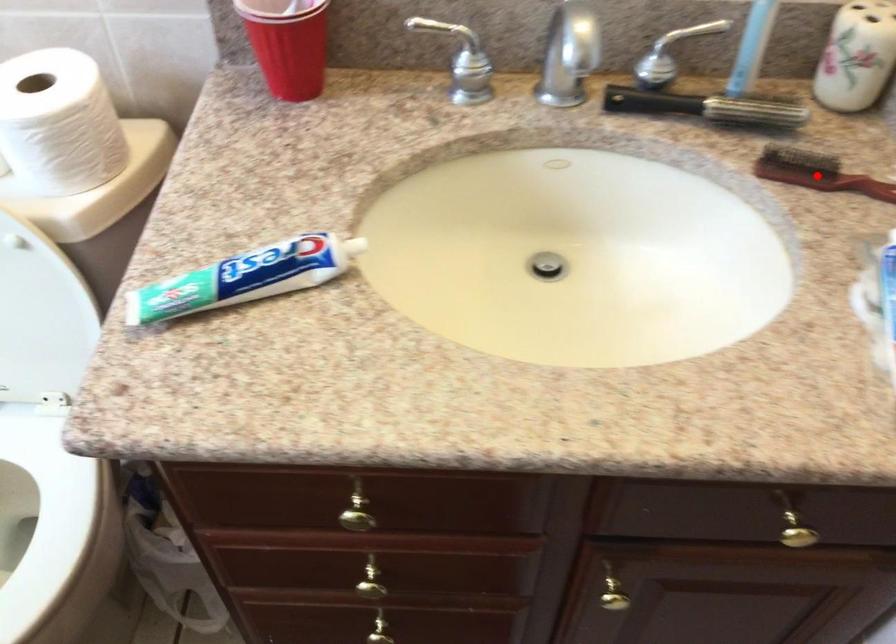
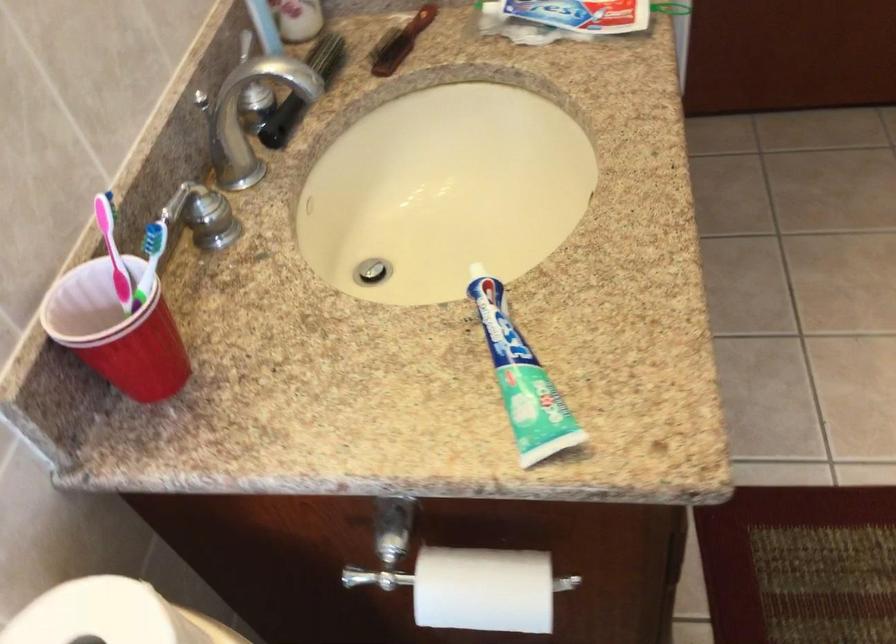
Question: I am providing you with two images of the same scene from different viewpoints. Given a red point in image1, look at the same physical point in image2. Is it:

Choices:
 (A) Closer to the viewpoint
 (B) Farther from the viewpoint

Answer: (B)